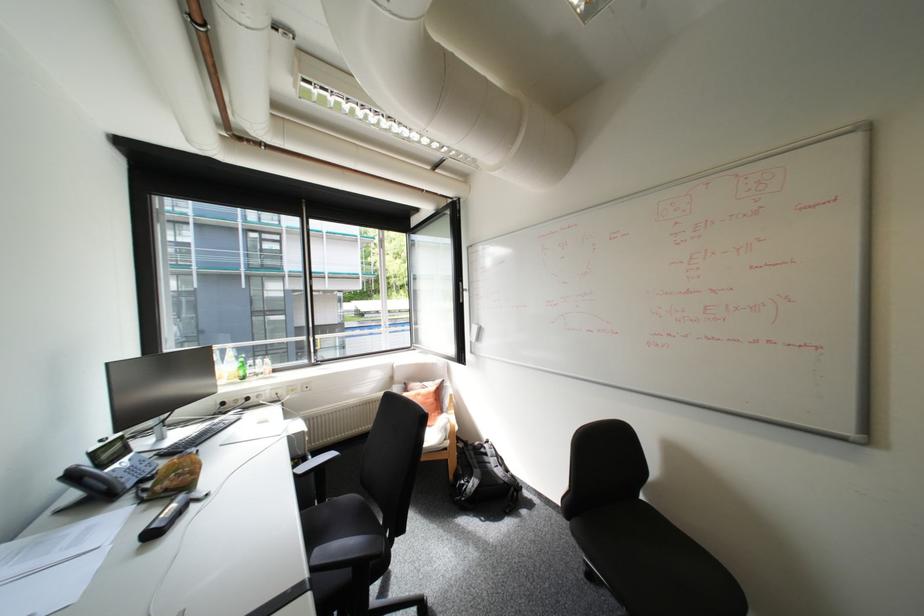
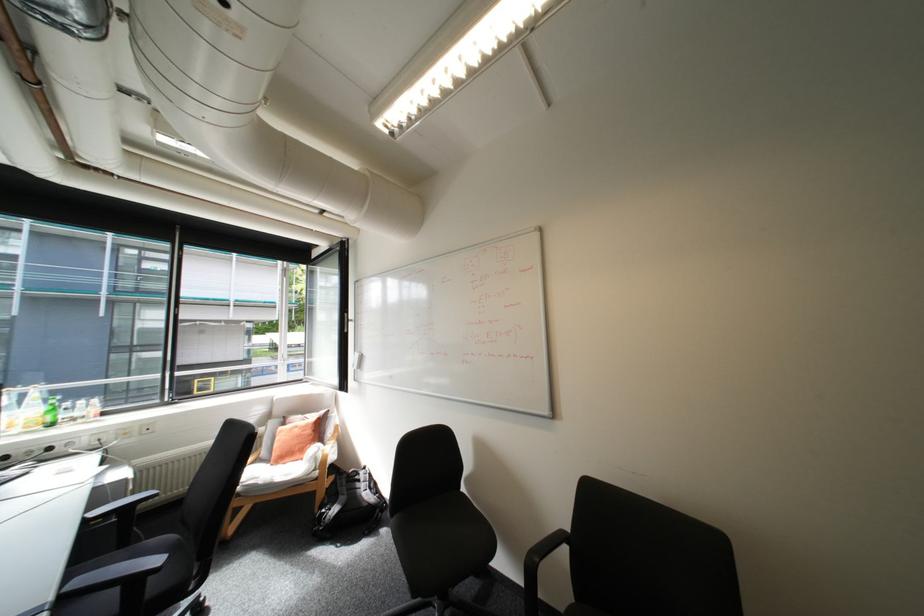
Question: How did the camera likely rotate?

Choices:
 (A) Left
 (B) Right
 (C) Up
 (D) Down

Answer: (B)